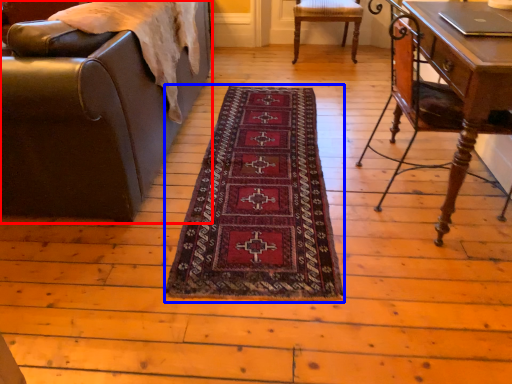
Question: Which point is further to the camera, chair (highlighted by a red box) or mat (highlighted by a blue box)?

Choices:
 (A) chair
 (B) mat

Answer: (B)